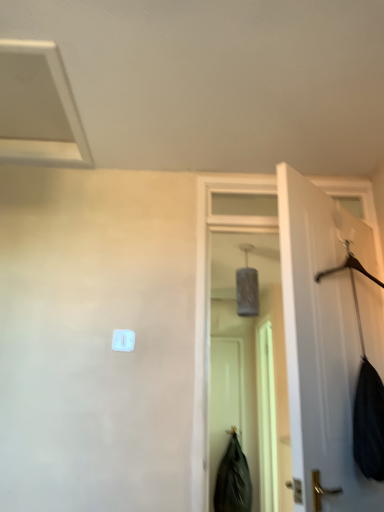
Question: From the image's perspective, is black matte screen door at center, the second screen door from the right, beneath black matte coat at lower center?

Choices:
 (A) yes
 (B) no

Answer: (B)

Question: Is black matte screen door at center, the first screen door when ordered from left to right, further to the viewer compared to black matte coat at lower center?

Choices:
 (A) no
 (B) yes

Answer: (B)

Question: Does black matte screen door at center, the first screen door when ordered from left to right, appear on the left side of black matte coat at lower center?

Choices:
 (A) yes
 (B) no

Answer: (A)

Question: From the image's perspective, is black matte screen door at center, the first screen door when ordered from left to right, on top of black matte coat at lower center?

Choices:
 (A) yes
 (B) no

Answer: (A)

Question: Is there a large distance between black matte screen door at center, the second screen door from the right, and black matte coat at lower center?

Choices:
 (A) no
 (B) yes

Answer: (A)

Question: From the image's perspective, relative to white plastic light switch at center, is translucent plastic screen door at center, which is the 1th screen door in right-to-left order, above or below?

Choices:
 (A) below
 (B) above

Answer: (A)

Question: In terms of height, does translucent plastic screen door at center, positioned as the second screen door in left-to-right order, look taller or shorter compared to white plastic light switch at center?

Choices:
 (A) tall
 (B) short

Answer: (A)

Question: In terms of size, does translucent plastic screen door at center, which is the 1th screen door in right-to-left order, appear bigger or smaller than white plastic light switch at center?

Choices:
 (A) small
 (B) big

Answer: (B)

Question: Considering the positions of translucent plastic screen door at center, which is the 1th screen door in right-to-left order, and white plastic light switch at center in the image, is translucent plastic screen door at center, which is the 1th screen door in right-to-left order, wider or thinner than white plastic light switch at center?

Choices:
 (A) thin
 (B) wide

Answer: (B)

Question: In terms of width, does black matte screen door at center, the second screen door from the right, look wider or thinner when compared to white plastic exhaust hood at upper left?

Choices:
 (A) wide
 (B) thin

Answer: (B)

Question: In the image, is black matte screen door at center, the first screen door when ordered from left to right, positioned in front of or behind white plastic exhaust hood at upper left?

Choices:
 (A) front
 (B) behind

Answer: (B)

Question: Is point (211, 415) positioned closer to the camera than point (76, 150)?

Choices:
 (A) closer
 (B) farther

Answer: (B)

Question: Which is correct: black matte screen door at center, the second screen door from the right, is inside white plastic exhaust hood at upper left, or outside of it?

Choices:
 (A) inside
 (B) outside

Answer: (B)

Question: From the image's perspective, is white plastic light switch at center positioned above or below white plastic exhaust hood at upper left?

Choices:
 (A) above
 (B) below

Answer: (B)

Question: Considering the positions of point tap(122, 347) and point tap(38, 49), is point tap(122, 347) closer or farther from the camera than point tap(38, 49)?

Choices:
 (A) farther
 (B) closer

Answer: (A)